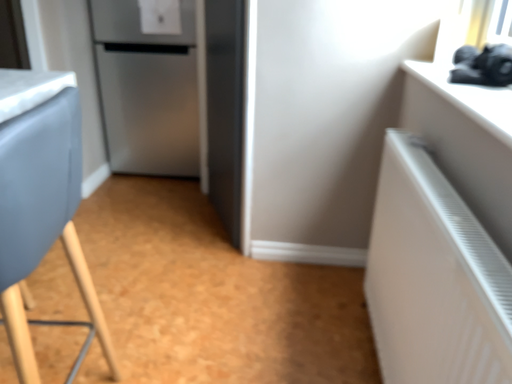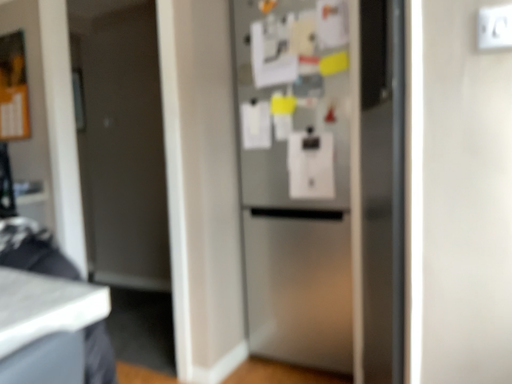
Question: How did the camera likely rotate when shooting the video?

Choices:
 (A) rotated downward
 (B) rotated upward

Answer: (B)